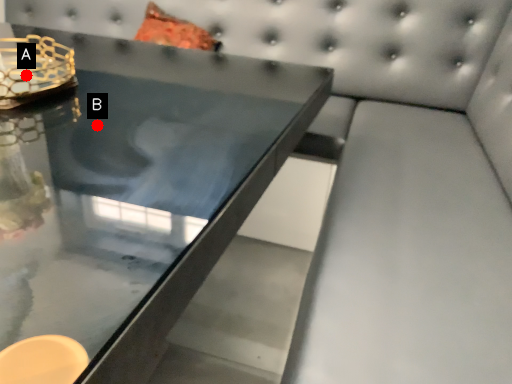
Question: Two points are circled on the image, labeled by A and B beside each circle. Which point is further to the camera?

Choices:
 (A) A is further
 (B) B is further

Answer: (A)